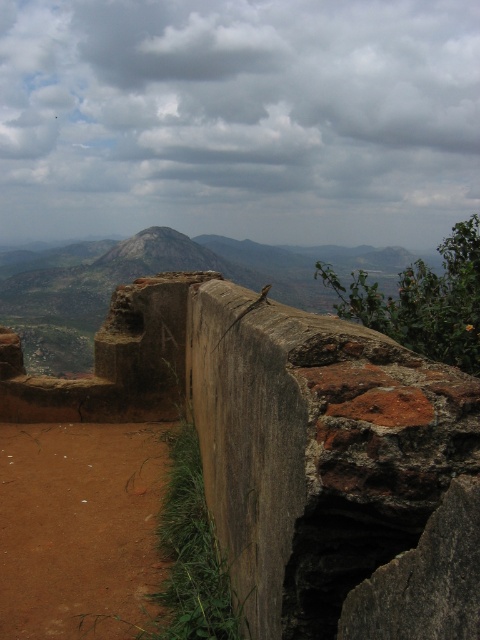
You are a hiker standing on the dirt path and want to reach the rustic stone peak at center. Which direction should you go relative to the rusty brick wall at center?

The rusty brick wall at center is positioned on the right side of rustic stone peak at center, so you should go to the left of the rusty brick wall at center to reach the rustic stone peak at center.

You are a hiker standing on the dirt path and want to take a photo of both the rusty brick wall at center and the rustic stone peak at center. Which object should you focus on first to ensure both are in clear view?

You should focus on the rusty brick wall at center first because it is closer to you than the rustic stone peak at center, so adjusting focus from near to far will help both be in clear view.

You are standing at the starting point of the dirt path and want to reach the rusty brick wall at center. According to the coordinates provided, is the wall positioned to your left, right, or directly ahead?

The rusty brick wall at center is located at point coordinates, so it is positioned directly ahead of you along the dirt path.